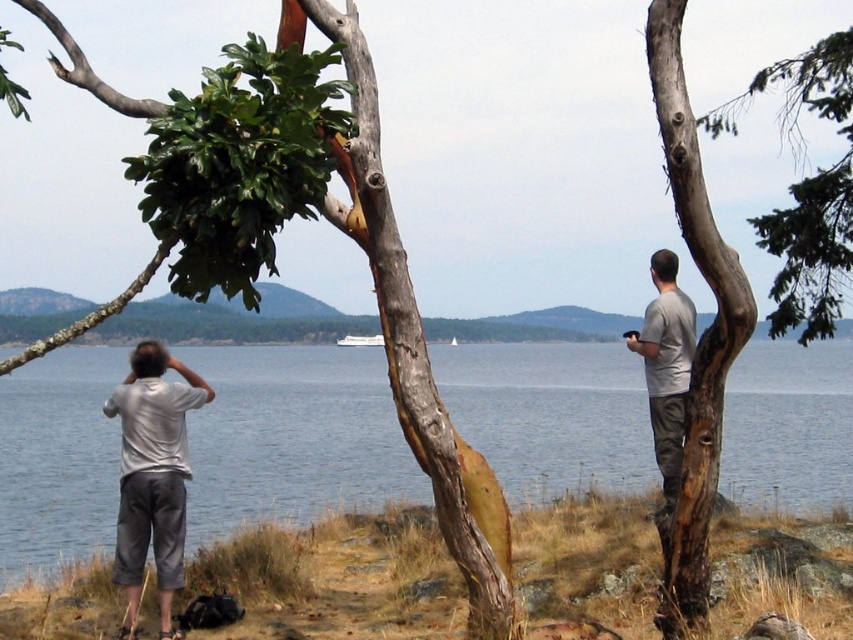
Question: Is blue water at center further to camera compared to smooth bark tree trunk at right?

Choices:
 (A) no
 (B) yes

Answer: (A)

Question: Is blue water at center behind brown grass at lower center?

Choices:
 (A) no
 (B) yes

Answer: (A)

Question: Can you confirm if blue water at center is wider than brown grass at lower center?

Choices:
 (A) yes
 (B) no

Answer: (A)

Question: Estimate the real-world distances between objects in this image. Which object is farther from the white cotton shirt at left?

Choices:
 (A) gray matte shirt at right
 (B) smooth bark tree trunk at right
 (C) blue water at center
 (D) brown grass at lower center

Answer: (C)

Question: Which point appears closest to the camera in this image?

Choices:
 (A) (828, 108)
 (B) (97, 384)
 (C) (648, 328)

Answer: (C)

Question: Which point appears closest to the camera in this image?

Choices:
 (A) (799, 60)
 (B) (209, 472)

Answer: (A)